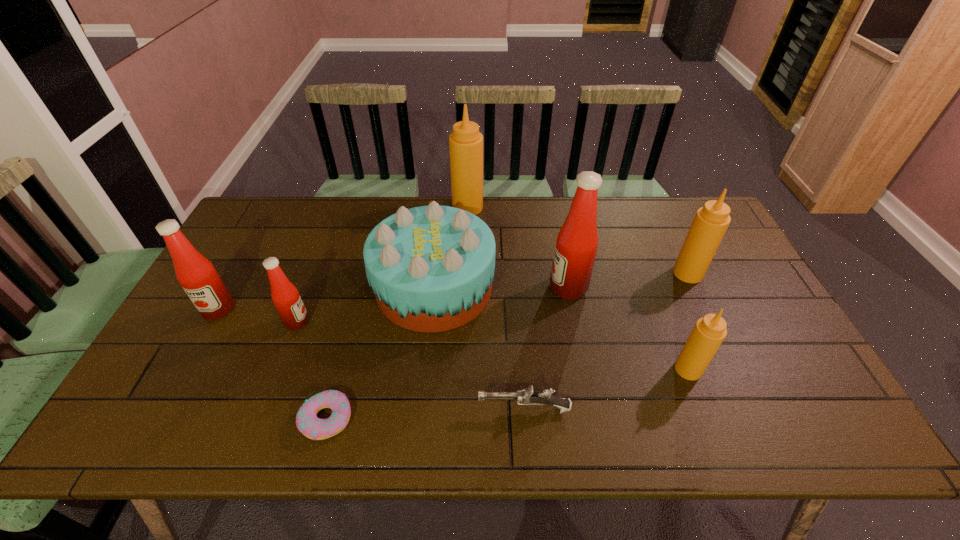
This screenshot has width=960, height=540. Identify the location of vacant region located 0.290m on the front-facing side of the second smallest red condiment. click(x=156, y=422).

At what (x,y) coordinates should I click in order to perform the action: click on vacant space positioned on the front of the cake. Please return your answer as a coordinate pair (x, y). Looking at the image, I should click on (425, 375).

You are a GUI agent. You are given a task and a screenshot of the screen. Output one action in this format:
    pyautogui.click(x=<x>, y=<y>)
    Task: Click on the vacant area situated 0.370m on the back of the smallest tan condiment
    
    Given the screenshot: What is the action you would take?
    pyautogui.click(x=645, y=259)

In order to click on free space located 0.200m on the front-facing side of the smallest red condiment in this screenshot , I will do `click(383, 322)`.

This screenshot has height=540, width=960. What are the coordinates of `free space located 0.380m aimed along the barrel of the eighth tallest object` in the screenshot? It's located at (314, 409).

At what (x,y) coordinates should I click in order to perform the action: click on vacant space situated 0.270m aimed along the barrel of the eighth tallest object. Please return your answer as a coordinate pair (x, y). This screenshot has width=960, height=540. Looking at the image, I should click on (361, 409).

You are a GUI agent. You are given a task and a screenshot of the screen. Output one action in this format:
    pyautogui.click(x=<x>, y=<y>)
    Task: Click on the free spot located aimed along the barrel of the eighth tallest object
    The height and width of the screenshot is (540, 960).
    Given the screenshot: What is the action you would take?
    pyautogui.click(x=422, y=409)

The width and height of the screenshot is (960, 540). In order to click on vacant area situated 0.090m on the back of the shortest object in this screenshot , I will do `click(341, 363)`.

This screenshot has height=540, width=960. What are the coordinates of `object that is at the far edge` in the screenshot? It's located at (465, 142).

Locate an element on the screen. The width and height of the screenshot is (960, 540). gun that is at the near edge is located at coordinates (528, 396).